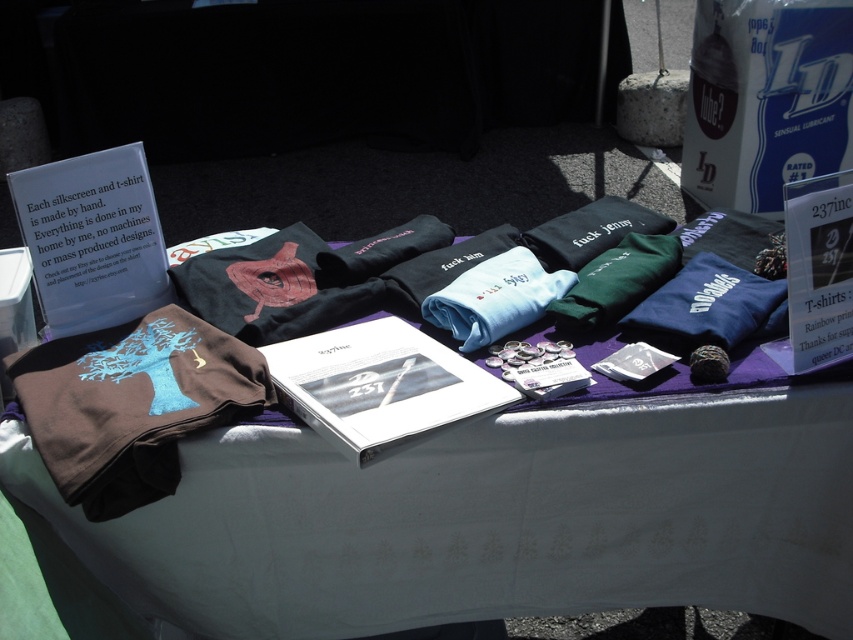
Question: Can you confirm if brown cotton t-shirt at lower left is positioned below light blue cotton t-shirt at center?

Choices:
 (A) no
 (B) yes

Answer: (B)

Question: Does brown cotton t-shirt at lower left have a greater width compared to light blue cotton t-shirt at center?

Choices:
 (A) yes
 (B) no

Answer: (A)

Question: Considering the relative positions of brown cotton t-shirt at lower left and light blue cotton t-shirt at center in the image provided, where is brown cotton t-shirt at lower left located with respect to light blue cotton t-shirt at center?

Choices:
 (A) left
 (B) right

Answer: (A)